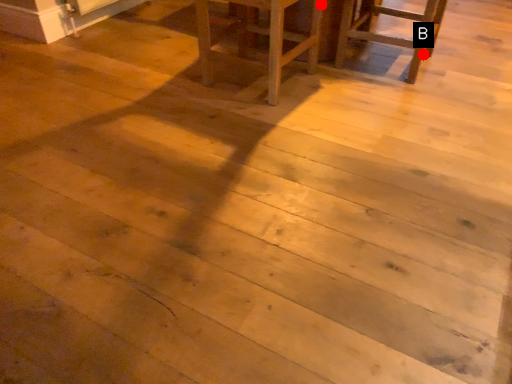
Question: Two points are circled on the image, labeled by A and B beside each circle. Which point is further to the camera?

Choices:
 (A) A is further
 (B) B is further

Answer: (B)